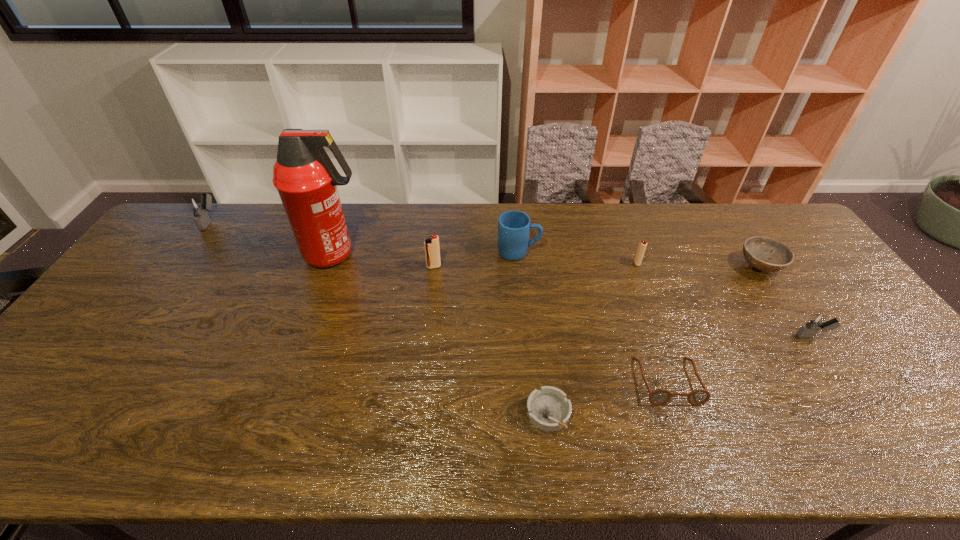
You are a GUI agent. You are given a task and a screenshot of the screen. Output one action in this format:
    pyautogui.click(x=<x>, y=<y>)
    Task: Click on the free spot located 0.090m on the left of the nearer gray igniter
    
    Given the screenshot: What is the action you would take?
    pyautogui.click(x=762, y=336)

Find the location of `vacant space located 0.110m on the left of the brown bowl`. vacant space located 0.110m on the left of the brown bowl is located at coordinates (702, 267).

Locate an element on the screen. free space located on the front-facing side of the spectacles is located at coordinates (685, 431).

The height and width of the screenshot is (540, 960). What are the coordinates of `vacant space located on the back of the shortest object` in the screenshot? It's located at (538, 325).

The image size is (960, 540). I want to click on fire extinguisher present at the far edge, so click(306, 179).

Identify the location of mug at the far edge. (514, 226).

In order to click on igniter that is at the far edge in this screenshot , I will do `click(199, 206)`.

You are a GUI agent. You are given a task and a screenshot of the screen. Output one action in this format:
    pyautogui.click(x=<x>, y=<y>)
    Task: Click on the object that is at the near edge
    The height and width of the screenshot is (540, 960).
    Given the screenshot: What is the action you would take?
    pyautogui.click(x=548, y=409)

Where is `object located at the left edge`? The image size is (960, 540). object located at the left edge is located at coordinates (199, 206).

In order to click on igniter that is at the right edge in this screenshot , I will do `click(817, 321)`.